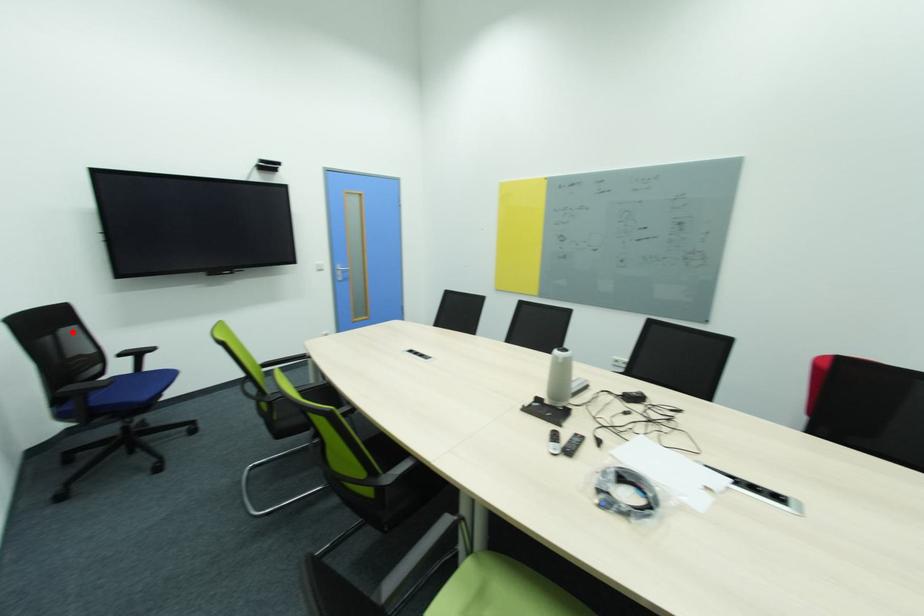
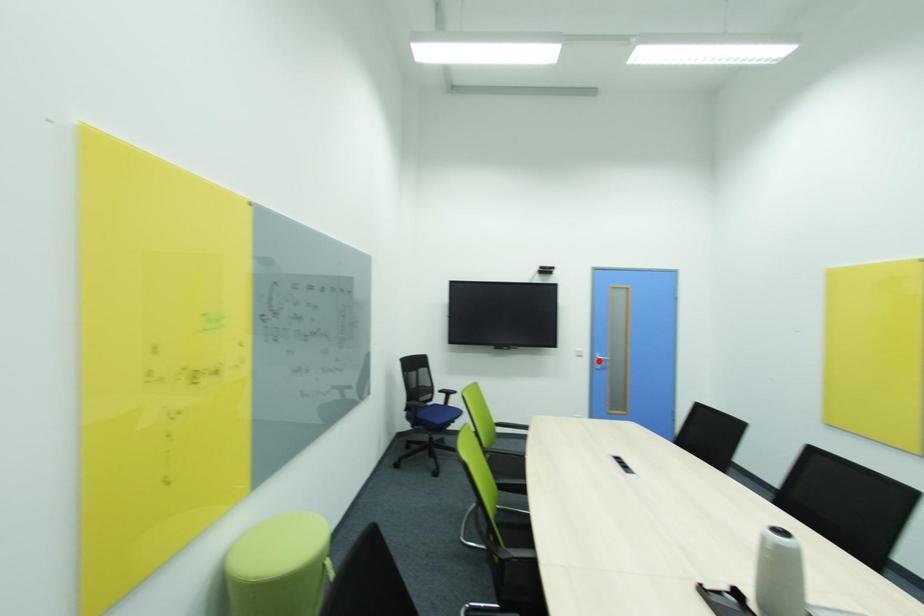
I am providing you with two images of the same scene from different viewpoints. A red point is marked on the first image and another point is marked on the second image. Does the point marked in image1 correspond to the same location as the one in image2?

No